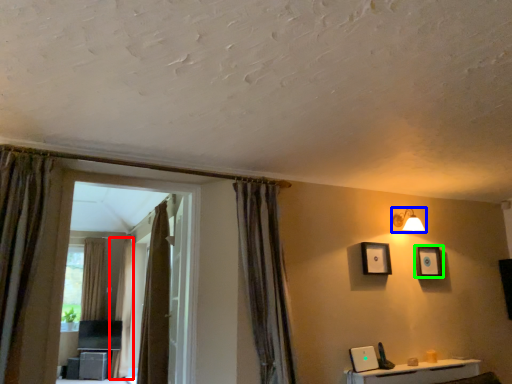
Question: Which object is positioned farthest from curtain (highlighted by a red box)? Select from light fixture (highlighted by a blue box) and picture frame (highlighted by a green box).

Choices:
 (A) light fixture
 (B) picture frame

Answer: (B)